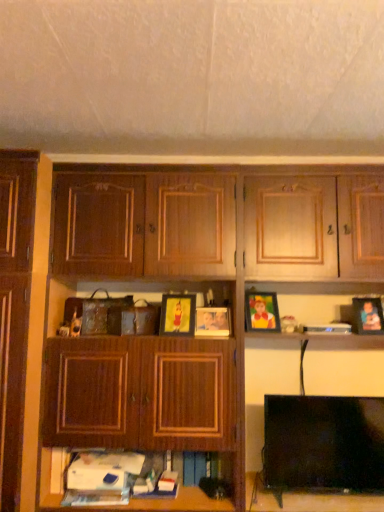
Question: Can you confirm if black plastic book at upper right is shorter than matte wooden picture frame at center, which ranks as the 4th picture frame in right-to-left order?

Choices:
 (A) yes
 (B) no

Answer: (A)

Question: Considering the relative positions of black plastic book at upper right and matte wooden picture frame at center, which ranks as the 4th picture frame in right-to-left order, in the image provided, is black plastic book at upper right in front of matte wooden picture frame at center, which ranks as the 4th picture frame in right-to-left order,?

Choices:
 (A) no
 (B) yes

Answer: (A)

Question: Considering the relative sizes of black plastic book at upper right and matte wooden picture frame at center, which is the first picture frame from left to right, in the image provided, is black plastic book at upper right thinner than matte wooden picture frame at center, which is the first picture frame from left to right,?

Choices:
 (A) yes
 (B) no

Answer: (B)

Question: From the image's perspective, is black plastic book at upper right on top of matte wooden picture frame at center, which ranks as the 4th picture frame in right-to-left order?

Choices:
 (A) no
 (B) yes

Answer: (A)

Question: Considering the relative sizes of black plastic book at upper right and matte wooden picture frame at center, which ranks as the 4th picture frame in right-to-left order, in the image provided, is black plastic book at upper right smaller than matte wooden picture frame at center, which ranks as the 4th picture frame in right-to-left order,?

Choices:
 (A) no
 (B) yes

Answer: (B)

Question: Is black plastic book at upper right taller than matte wooden picture frame at center, which ranks as the 4th picture frame in right-to-left order?

Choices:
 (A) no
 (B) yes

Answer: (A)

Question: From a real-world perspective, is matte plastic picture frame at right, the first picture frame positioned from the right, below black plastic book at upper right?

Choices:
 (A) yes
 (B) no

Answer: (B)

Question: Is matte plastic picture frame at right, which is counted as the fourth picture frame, starting from the left, to the left of black plastic book at upper right from the viewer's perspective?

Choices:
 (A) yes
 (B) no

Answer: (B)

Question: Considering the relative sizes of matte plastic picture frame at right, which is counted as the fourth picture frame, starting from the left, and black plastic book at upper right in the image provided, is matte plastic picture frame at right, which is counted as the fourth picture frame, starting from the left, shorter than black plastic book at upper right?

Choices:
 (A) yes
 (B) no

Answer: (B)

Question: Is black plastic book at upper right a part of matte plastic picture frame at right, the first picture frame positioned from the right?

Choices:
 (A) no
 (B) yes

Answer: (A)

Question: Is matte plastic picture frame at right, the first picture frame positioned from the right, oriented towards black plastic book at upper right?

Choices:
 (A) yes
 (B) no

Answer: (B)

Question: Is matte plastic picture frame at right, which is counted as the fourth picture frame, starting from the left, to the right of black plastic book at upper right from the viewer's perspective?

Choices:
 (A) no
 (B) yes

Answer: (B)

Question: Considering the relative positions of wooden cabinet at center and matte wooden picture frame at center, which is the 2th picture frame in left-to-right order, in the image provided, is wooden cabinet at center to the left of matte wooden picture frame at center, which is the 2th picture frame in left-to-right order, from the viewer's perspective?

Choices:
 (A) no
 (B) yes

Answer: (A)